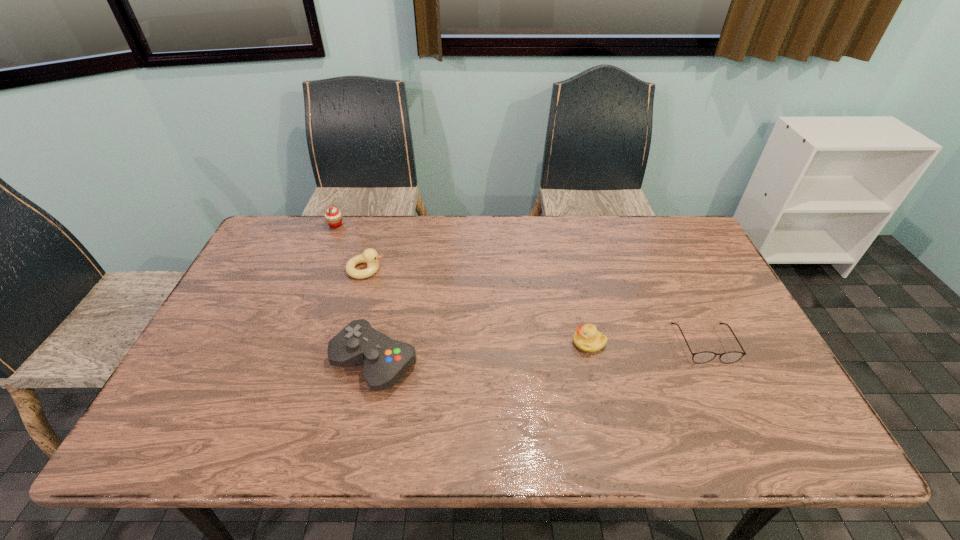
Locate an element on the screen. The width and height of the screenshot is (960, 540). free spot between the leftmost object and the left duckling is located at coordinates (350, 247).

Locate an element on the screen. blank region between the farther duckling and the rightmost object is located at coordinates [x=535, y=306].

Locate an element on the screen. free spot between the shortest object and the second farthest object is located at coordinates (535, 306).

Locate an element on the screen. Image resolution: width=960 pixels, height=540 pixels. free spot between the leftmost object and the right duckling is located at coordinates (463, 284).

Where is `vacant space that is in between the control and the rightmost object`? This screenshot has height=540, width=960. vacant space that is in between the control and the rightmost object is located at coordinates (540, 353).

At what (x,y) coordinates should I click in order to perform the action: click on free space between the nearer duckling and the taller duckling. Please return your answer as a coordinate pair (x, y). The height and width of the screenshot is (540, 960). Looking at the image, I should click on (477, 306).

Select which object is the second closest to the control. Please provide its 2D coordinates. Your answer should be formatted as a tuple, i.e. [(x, y)], where the tuple contains the x and y coordinates of a point satisfying the conditions above.

[(587, 338)]

Find the location of `the closest object to the taller duckling`. the closest object to the taller duckling is located at coordinates (333, 217).